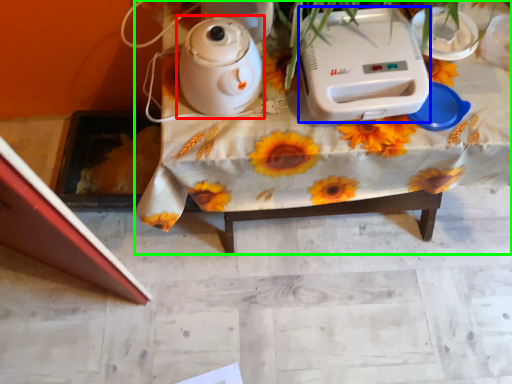
Question: Estimate the real-world distances between objects in this image. Which object is farther from kettle (highlighted by a red box), appliance (highlighted by a blue box) or table (highlighted by a green box)?

Choices:
 (A) appliance
 (B) table

Answer: (A)